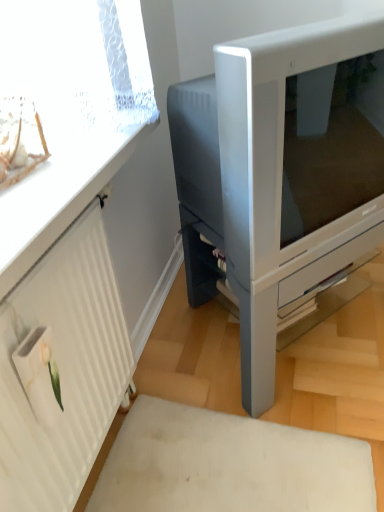
Locate an element on the screen. vacant region in front of satin silver monitor at center is located at coordinates (286, 432).